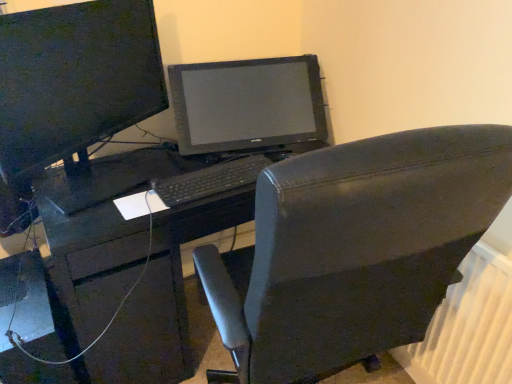
The image size is (512, 384). In order to click on vacant space in matte black monitor at upper left (from a real-world perspective) in this screenshot , I will do `click(118, 175)`.